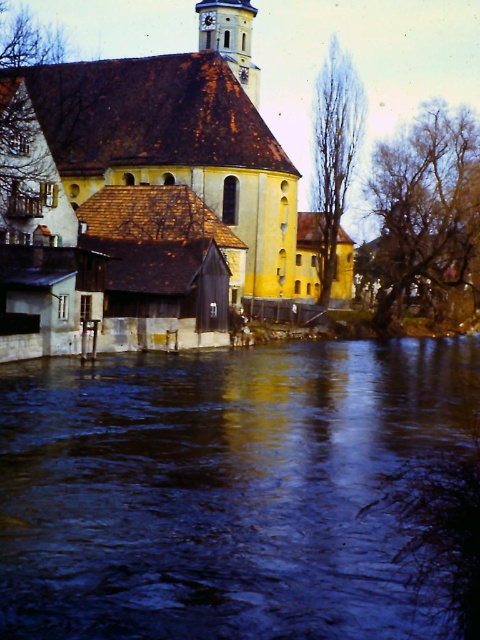
Describe the element at coordinates (217, 490) in the screenshot. I see `blue water at center` at that location.

Does blue water at center lie in front of white stucco clock tower at upper center?

Yes, it is.

The width and height of the screenshot is (480, 640). Identify the location of blue water at center. (217, 490).

Does yellow matte church at center appear on the right side of white stucco clock tower at upper center?

No, yellow matte church at center is not to the right of white stucco clock tower at upper center.

Can you confirm if yellow matte church at center is positioned below white stucco clock tower at upper center?

Yes, yellow matte church at center is below white stucco clock tower at upper center.

Is point (314, 240) farther from viewer compared to point (202, 33)?

That is False.

The image size is (480, 640). Identify the location of yellow matte church at center. (156, 196).

Does blue water at center have a lesser width compared to yellow matte church at center?

Indeed, blue water at center has a lesser width compared to yellow matte church at center.

Which is more to the left, blue water at center or yellow matte church at center?

yellow matte church at center is more to the left.

Does point (410, 340) lie behind point (210, 83)?

No, it is in front of (210, 83).

What are the coordinates of `blue water at center` in the screenshot? It's located at (217, 490).